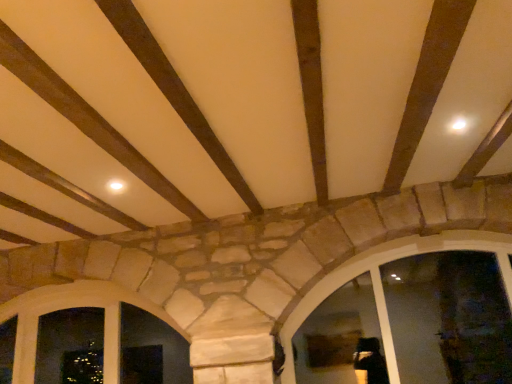
The width and height of the screenshot is (512, 384). Describe the element at coordinates (380, 264) in the screenshot. I see `natural stone window at center, which is the second window from left to right` at that location.

Identify the location of natural stone window at center, which is the second window from left to right. This screenshot has width=512, height=384. (380, 264).

Measure the distance between natural stone window at lower left, the 2th window when ordered from right to left, and camera.

natural stone window at lower left, the 2th window when ordered from right to left, is 3.07 meters from camera.

At what (x,y) coordinates should I click in order to perform the action: click on natural stone window at lower left, the 2th window when ordered from right to left. Please return your answer as a coordinate pair (x, y). Looking at the image, I should click on (73, 307).

The height and width of the screenshot is (384, 512). What do you see at coordinates (73, 307) in the screenshot?
I see `natural stone window at lower left, the 2th window when ordered from right to left` at bounding box center [73, 307].

In order to click on natural stone window at center, placed as the first window when sorted from right to left in this screenshot , I will do `click(380, 264)`.

Which object is positioned more to the right, natural stone window at center, placed as the first window when sorted from right to left, or natural stone window at lower left, positioned as the 1th window in left-to-right order?

natural stone window at center, placed as the first window when sorted from right to left, is more to the right.

In the image, is natural stone window at center, which is the second window from left to right, positioned in front of or behind natural stone window at lower left, positioned as the 1th window in left-to-right order?

Clearly, natural stone window at center, which is the second window from left to right, is in front of natural stone window at lower left, positioned as the 1th window in left-to-right order.

Which is further, (409, 242) or (25, 293)?

The point (25, 293) is farther from the camera.

From the image's perspective, which is above, natural stone window at center, which is the second window from left to right, or natural stone window at lower left, positioned as the 1th window in left-to-right order?

From the image's view, natural stone window at center, which is the second window from left to right, is above.

From a real-world perspective, does natural stone window at center, which is the second window from left to right, sit lower than natural stone window at lower left, the 2th window when ordered from right to left?

Yes, from a real-world perspective, natural stone window at center, which is the second window from left to right, is beneath natural stone window at lower left, the 2th window when ordered from right to left.

Can you confirm if natural stone window at center, which is the second window from left to right, is wider than natural stone window at lower left, the 2th window when ordered from right to left?

Yes, natural stone window at center, which is the second window from left to right, is wider than natural stone window at lower left, the 2th window when ordered from right to left.

Is natural stone window at center, placed as the first window when sorted from right to left, taller or shorter than natural stone window at lower left, the 2th window when ordered from right to left?

Considering their sizes, natural stone window at center, placed as the first window when sorted from right to left, has more height than natural stone window at lower left, the 2th window when ordered from right to left.

Considering the relative sizes of natural stone window at center, which is the second window from left to right, and natural stone window at lower left, the 2th window when ordered from right to left, in the image provided, is natural stone window at center, which is the second window from left to right, smaller than natural stone window at lower left, the 2th window when ordered from right to left,?

Actually, natural stone window at center, which is the second window from left to right, might be larger than natural stone window at lower left, the 2th window when ordered from right to left.

Is natural stone window at center, which is the second window from left to right, spatially inside natural stone window at lower left, positioned as the 1th window in left-to-right order, or outside of it?

natural stone window at center, which is the second window from left to right, is located beyond the bounds of natural stone window at lower left, positioned as the 1th window in left-to-right order.

Is natural stone window at center, placed as the first window when sorted from right to left, not near natural stone window at lower left, the 2th window when ordered from right to left?

Yes, natural stone window at center, placed as the first window when sorted from right to left, and natural stone window at lower left, the 2th window when ordered from right to left, are located far from each other.

Based on the photo, could you tell me if natural stone window at center, placed as the first window when sorted from right to left, is turned towards natural stone window at lower left, the 2th window when ordered from right to left?

No, natural stone window at center, placed as the first window when sorted from right to left, is not aimed at natural stone window at lower left, the 2th window when ordered from right to left.

Can you tell me how much natural stone window at center, which is the second window from left to right, and natural stone window at lower left, positioned as the 1th window in left-to-right order, differ in facing direction?

The facing directions of natural stone window at center, which is the second window from left to right, and natural stone window at lower left, positioned as the 1th window in left-to-right order, are 1.69 degrees apart.

At what (x,y) coordinates should I click in order to perform the action: click on window that is behind the natural stone window at center, which is the second window from left to right. Please return your answer as a coordinate pair (x, y). Looking at the image, I should click on (73, 307).

Would you say natural stone window at lower left, positioned as the 1th window in left-to-right order, is to the left or to the right of natural stone window at center, placed as the first window when sorted from right to left, in the picture?

natural stone window at lower left, positioned as the 1th window in left-to-right order, is to the left of natural stone window at center, placed as the first window when sorted from right to left.

In the image, is natural stone window at lower left, positioned as the 1th window in left-to-right order, positioned in front of or behind natural stone window at center, which is the second window from left to right?

Visually, natural stone window at lower left, positioned as the 1th window in left-to-right order, is located behind natural stone window at center, which is the second window from left to right.

Is point (118, 295) farther from viewer compared to point (412, 237)?

That is True.

From the image's perspective, between natural stone window at lower left, positioned as the 1th window in left-to-right order, and natural stone window at center, placed as the first window when sorted from right to left, which one is located above?

natural stone window at center, placed as the first window when sorted from right to left, from the image's perspective.

From a real-world perspective, between natural stone window at lower left, positioned as the 1th window in left-to-right order, and natural stone window at center, which is the second window from left to right, who is vertically lower?

From a 3D spatial view, natural stone window at center, which is the second window from left to right, is below.

Considering the sizes of objects natural stone window at lower left, positioned as the 1th window in left-to-right order, and natural stone window at center, placed as the first window when sorted from right to left, in the image provided, who is wider, natural stone window at lower left, positioned as the 1th window in left-to-right order, or natural stone window at center, placed as the first window when sorted from right to left,?

natural stone window at center, placed as the first window when sorted from right to left, is wider.

Is natural stone window at lower left, the 2th window when ordered from right to left, taller or shorter than natural stone window at center, which is the second window from left to right?

In the image, natural stone window at lower left, the 2th window when ordered from right to left, appears to be shorter than natural stone window at center, which is the second window from left to right.

Between natural stone window at lower left, the 2th window when ordered from right to left, and natural stone window at center, which is the second window from left to right, which one has smaller size?

With smaller size is natural stone window at lower left, the 2th window when ordered from right to left.

From the picture: Is natural stone window at lower left, positioned as the 1th window in left-to-right order, situated inside natural stone window at center, placed as the first window when sorted from right to left, or outside?

natural stone window at lower left, positioned as the 1th window in left-to-right order, cannot be found inside natural stone window at center, placed as the first window when sorted from right to left.

Is natural stone window at lower left, the 2th window when ordered from right to left, far away from natural stone window at center, which is the second window from left to right?

Yes, natural stone window at lower left, the 2th window when ordered from right to left, and natural stone window at center, which is the second window from left to right, are quite far apart.

Is natural stone window at lower left, positioned as the 1th window in left-to-right order, looking in the opposite direction of natural stone window at center, placed as the first window when sorted from right to left?

No.

Could you measure the distance between natural stone window at lower left, the 2th window when ordered from right to left, and natural stone window at center, which is the second window from left to right?

natural stone window at lower left, the 2th window when ordered from right to left, and natural stone window at center, which is the second window from left to right, are 5.52 feet apart from each other.

What are the coordinates of `window behind the natural stone window at center, which is the second window from left to right` in the screenshot? It's located at (73, 307).

I want to click on window that is behind the natural stone window at center, placed as the first window when sorted from right to left, so click(73, 307).

Image resolution: width=512 pixels, height=384 pixels. Find the location of `window above the natural stone window at center, placed as the first window when sorted from right to left (from a real-world perspective)`. window above the natural stone window at center, placed as the first window when sorted from right to left (from a real-world perspective) is located at coordinates (73, 307).